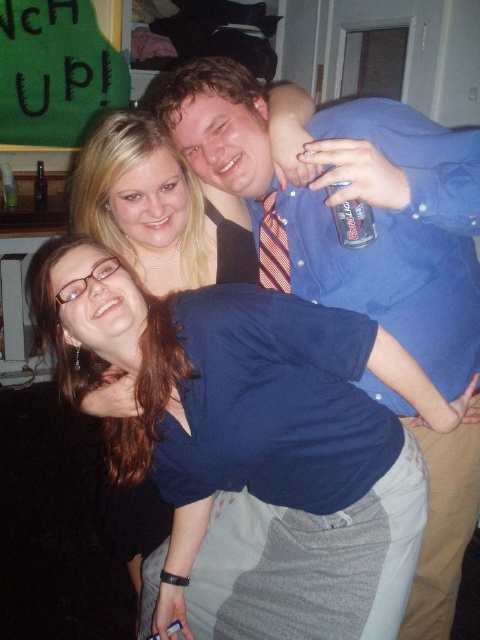
You are organizing a charity event and need to determine which item takes up more space between the blue fabric shirt at lower center and the striped fabric tie at center. Which one would require more storage space?

The blue fabric shirt at lower center has a larger size compared to the striped fabric tie at center, so it would require more storage space.

You are a fashion designer observing the blue fabric shirt at lower center and the striped fabric tie at center. Can you determine if there is enough space between them to insert a 10 centimeter wide accessory?

The blue fabric shirt at lower center and striped fabric tie at center are 15.41 centimeters apart, so yes, there is enough space to insert a 10 centimeter wide accessory between them.

You are standing in the room and want to move from point A to point B. Point A is located at coordinates point (257, 90) and point B is at point (130, 508). Which point is closer to you?

Point (257, 90) is closer to the viewer than point (130, 508).